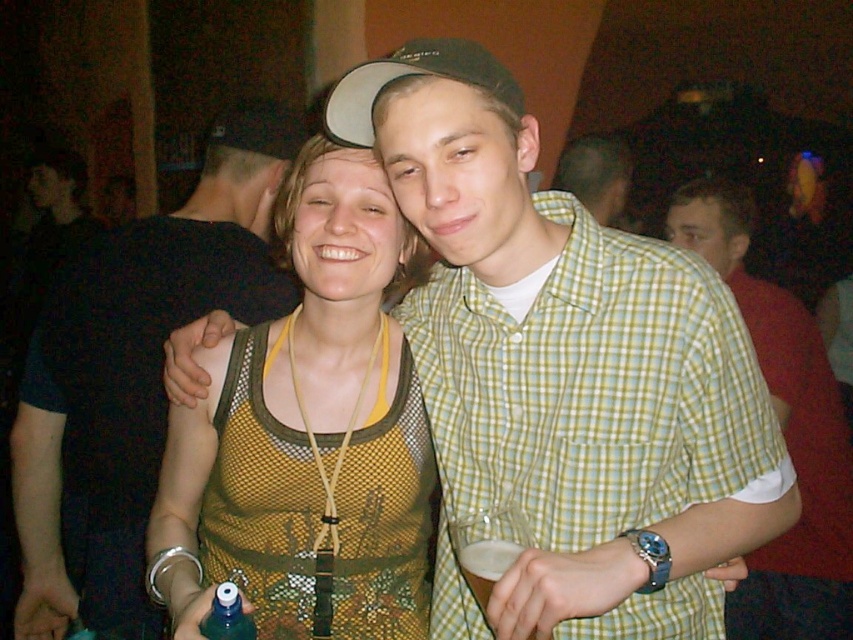
Can you confirm if yellow-green checkered shirt at center-right is thinner than matte green shirt at center?

No, yellow-green checkered shirt at center-right is not thinner than matte green shirt at center.

Does yellow-green checkered shirt at center-right have a greater height compared to matte green shirt at center?

Yes, yellow-green checkered shirt at center-right is taller than matte green shirt at center.

The image size is (853, 640). What are the coordinates of `yellow-green checkered shirt at center-right` in the screenshot? It's located at (782, 432).

Find the location of a particular element. The width and height of the screenshot is (853, 640). yellow-green checkered shirt at center-right is located at coordinates (782, 432).

Who is positioned more to the right, green checkered shirt at center or foamy white liquid at lower center?

green checkered shirt at center is more to the right.

Find the location of a particular element. The width and height of the screenshot is (853, 640). green checkered shirt at center is located at coordinates (585, 401).

Identify the location of green checkered shirt at center. (585, 401).

Does matte green shirt at center appear under foamy white liquid at lower center?

No, matte green shirt at center is not below foamy white liquid at lower center.

In the scene shown: Can you confirm if matte green shirt at center is thinner than foamy white liquid at lower center?

No.

What are the coordinates of `matte green shirt at center` in the screenshot? It's located at (595, 173).

What are the coordinates of `matte green shirt at center` in the screenshot? It's located at (x=595, y=173).